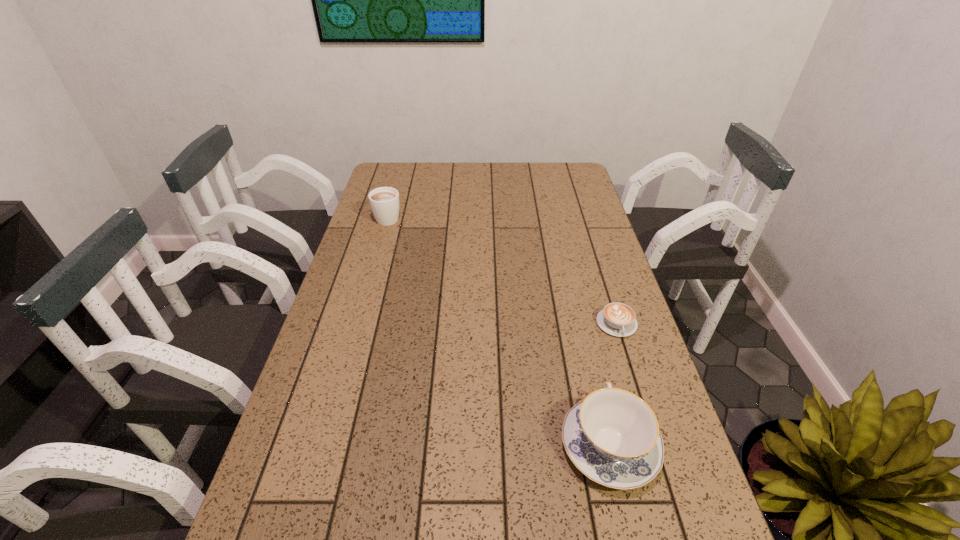
Select which object appears as the closest to the nearest object. Please provide its 2D coordinates. Your answer should be formatted as a tuple, i.e. [(x, y)], where the tuple contains the x and y coordinates of a point satisfying the conditions above.

[(617, 319)]